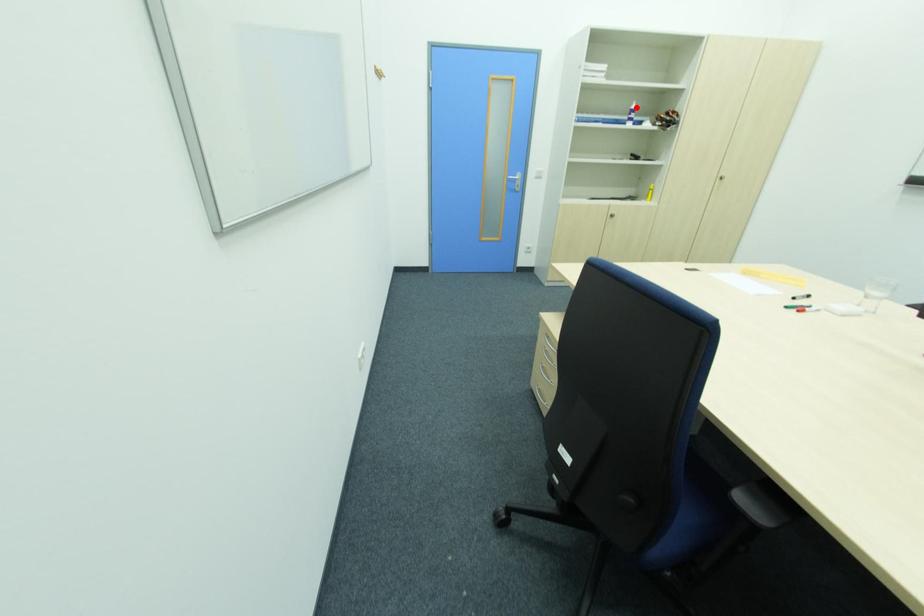
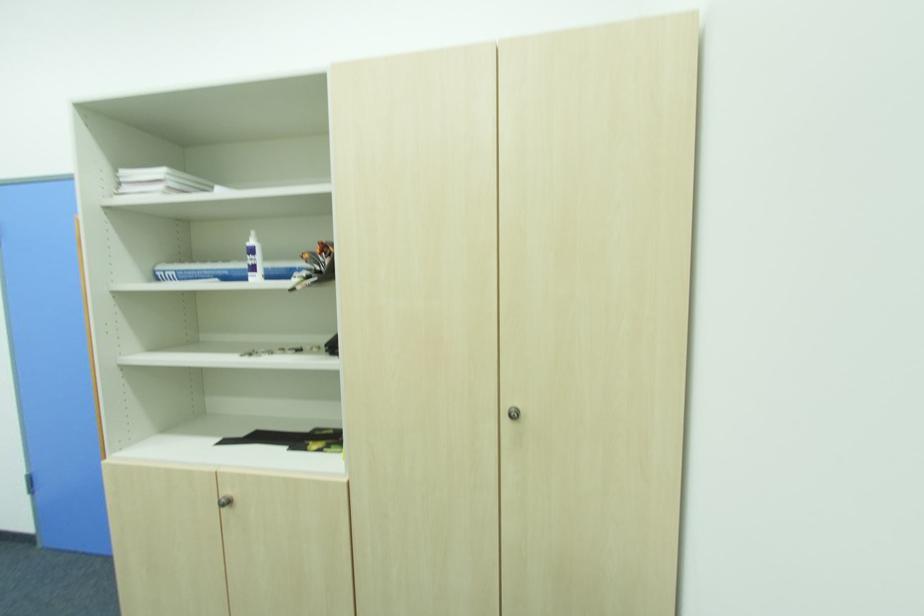
In the second image, find the point that corresponds to the highlighted location in the first image.

(254, 243)